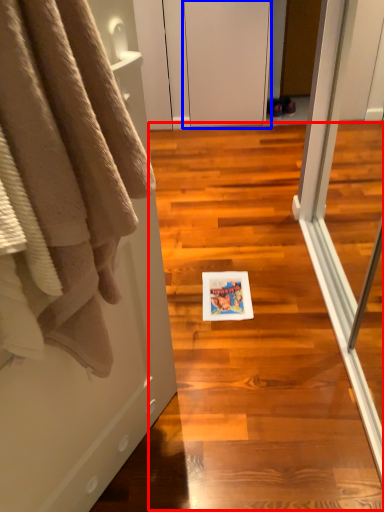
Question: Which object appears farthest to the camera in this image, stair (highlighted by a red box) or screen door (highlighted by a blue box)?

Choices:
 (A) stair
 (B) screen door

Answer: (B)